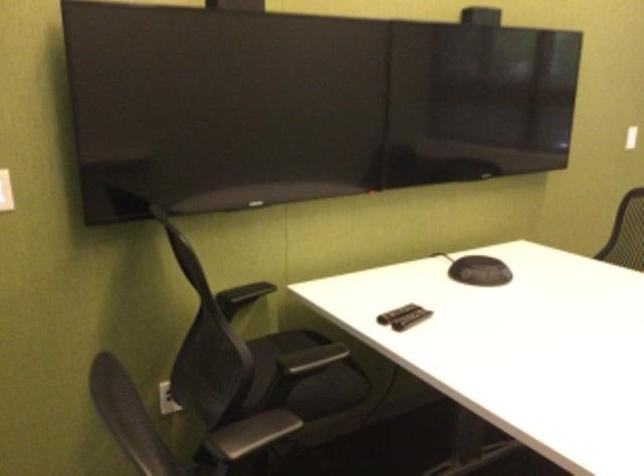
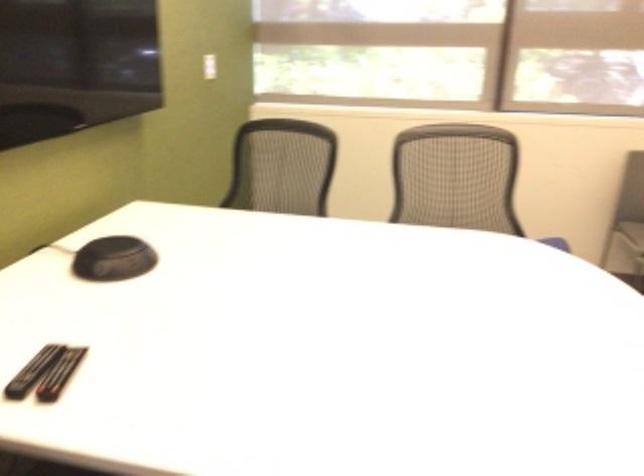
The point at (395, 313) is marked in the first image. Where is the corresponding point in the second image?

(32, 371)